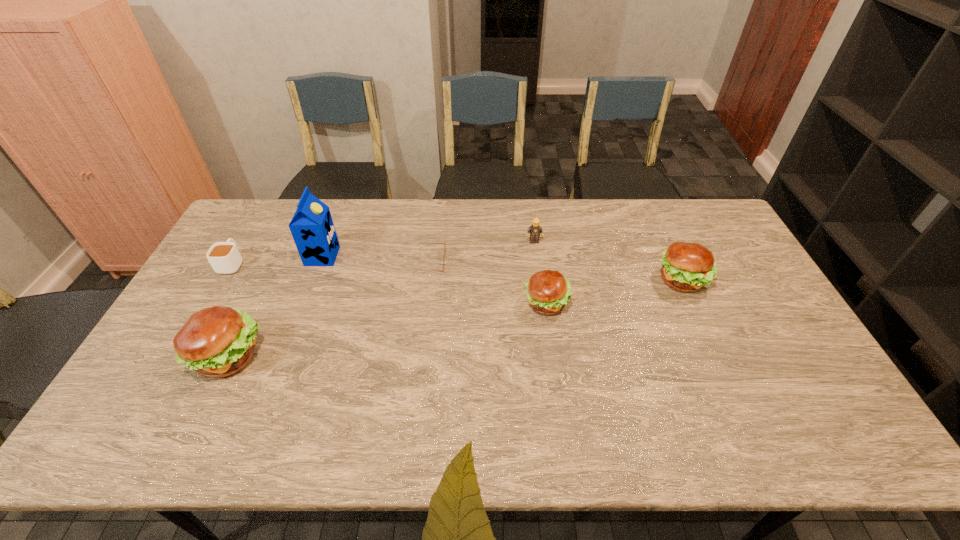
The image size is (960, 540). I want to click on free spot between the sunglasses and the farthest object, so 482,251.

Find the location of a particular element. The image size is (960, 540). free space between the sunglasses and the second object from left to right is located at coordinates (329, 308).

Point out which object is positioned as the second nearest to the third tallest object. Please provide its 2D coordinates. Your answer should be formatted as a tuple, i.e. [(x, y)], where the tuple contains the x and y coordinates of a point satisfying the conditions above.

[(534, 230)]

Select which object appears as the third closest to the tallest object. Please provide its 2D coordinates. Your answer should be formatted as a tuple, i.e. [(x, y)], where the tuple contains the x and y coordinates of a point satisfying the conditions above.

[(419, 243)]

Identify which hamburger is the nearest to the carton. Please provide its 2D coordinates. Your answer should be formatted as a tuple, i.e. [(x, y)], where the tuple contains the x and y coordinates of a point satisfying the conditions above.

[(218, 341)]

Where is `hamburger that is the second closest to the shortest hamburger`? The image size is (960, 540). hamburger that is the second closest to the shortest hamburger is located at coordinates (218, 341).

You are a GUI agent. You are given a task and a screenshot of the screen. Output one action in this format:
    pyautogui.click(x=<x>, y=<y>)
    Task: Click on the vacant space that satisfies the following two spatial constraints: 1. on the back side of the shortest hamburger; 2. with the cap open on the carton
    The height and width of the screenshot is (540, 960).
    Given the screenshot: What is the action you would take?
    pyautogui.click(x=540, y=256)

I want to click on vacant region that satisfies the following two spatial constraints: 1. with the cap open on the tallest object; 2. on the back side of the shortest hamburger, so click(x=305, y=303).

This screenshot has height=540, width=960. What are the coordinates of `free space that satisfies the following two spatial constraints: 1. on the back side of the second shortest hamburger; 2. on the face of the shortest object` in the screenshot? It's located at coord(674,261).

In order to click on free spot that satisfies the following two spatial constraints: 1. in front of the second hamburger from left to right; 2. on the left side of the farthest object in this screenshot , I will do pyautogui.click(x=542, y=303).